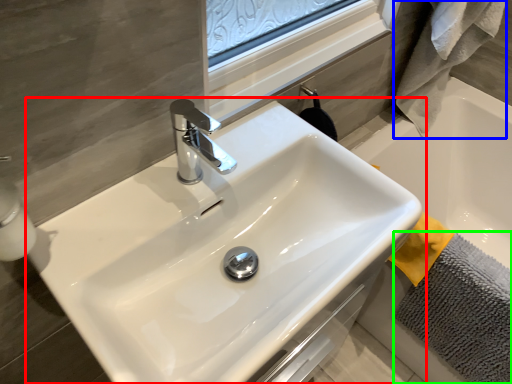
Question: Which object is positioned closest to sink (highlighted by a red box)? Select from bath towel (highlighted by a blue box) and bath towel (highlighted by a green box).

Choices:
 (A) bath towel
 (B) bath towel

Answer: (B)